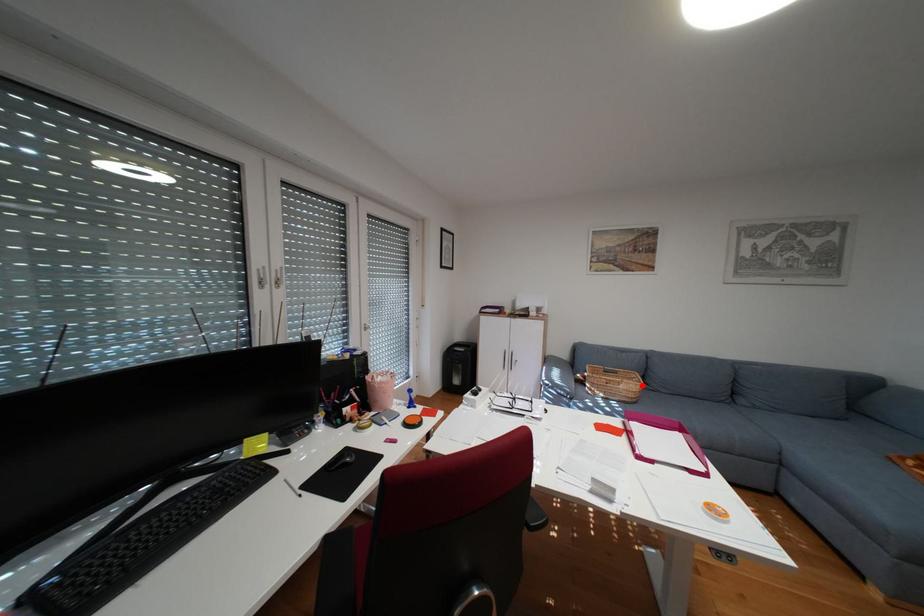
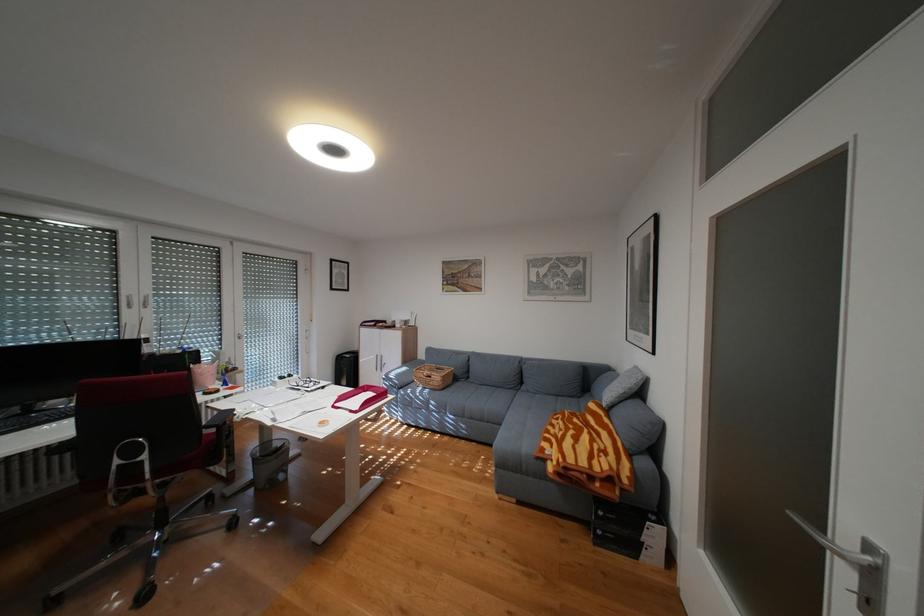
Find the pixel in the second image that matches the highlighted location in the first image.

(450, 377)